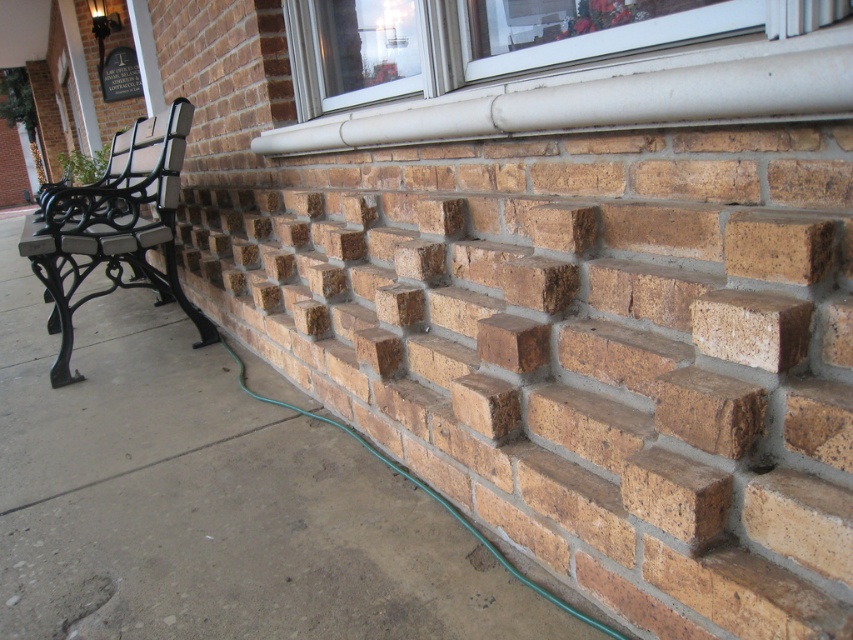
Does black wrought iron bench at left have a lesser height compared to brown rough brick at upper right?

Incorrect, black wrought iron bench at left's height does not fall short of brown rough brick at upper right's.

Locate an element on the screen. The image size is (853, 640). black wrought iron bench at left is located at coordinates (113, 227).

Does point (164, 276) come closer to viewer compared to point (735, 269)?

No, (164, 276) is behind (735, 269).

This screenshot has width=853, height=640. In order to click on black wrought iron bench at left in this screenshot , I will do `click(113, 227)`.

Can you confirm if brown brick pavement at lower right is positioned above black wrought iron bench at left?

No, brown brick pavement at lower right is not above black wrought iron bench at left.

This screenshot has width=853, height=640. Describe the element at coordinates (210, 500) in the screenshot. I see `brown brick pavement at lower right` at that location.

What are the coordinates of `brown brick pavement at lower right` in the screenshot? It's located at (210, 500).

Is brown brick pavement at lower right positioned before brown rough brick at upper right?

No, brown brick pavement at lower right is further to the viewer.

Can you confirm if brown brick pavement at lower right is positioned below brown rough brick at upper right?

Correct, brown brick pavement at lower right is located below brown rough brick at upper right.

Between point (128, 493) and point (779, 262), which one is positioned behind?

Point (128, 493)

Locate an element on the screen. The height and width of the screenshot is (640, 853). brown brick pavement at lower right is located at coordinates (210, 500).